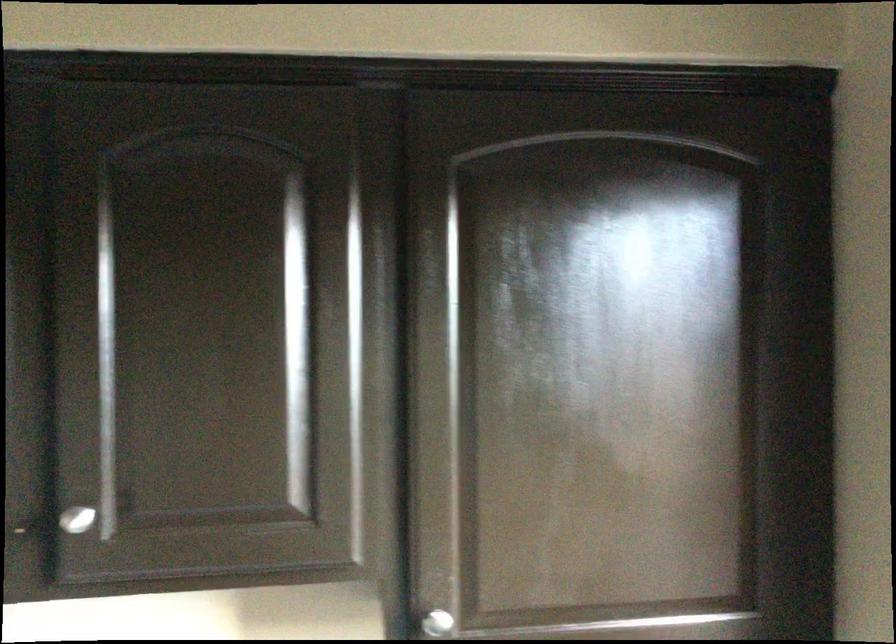
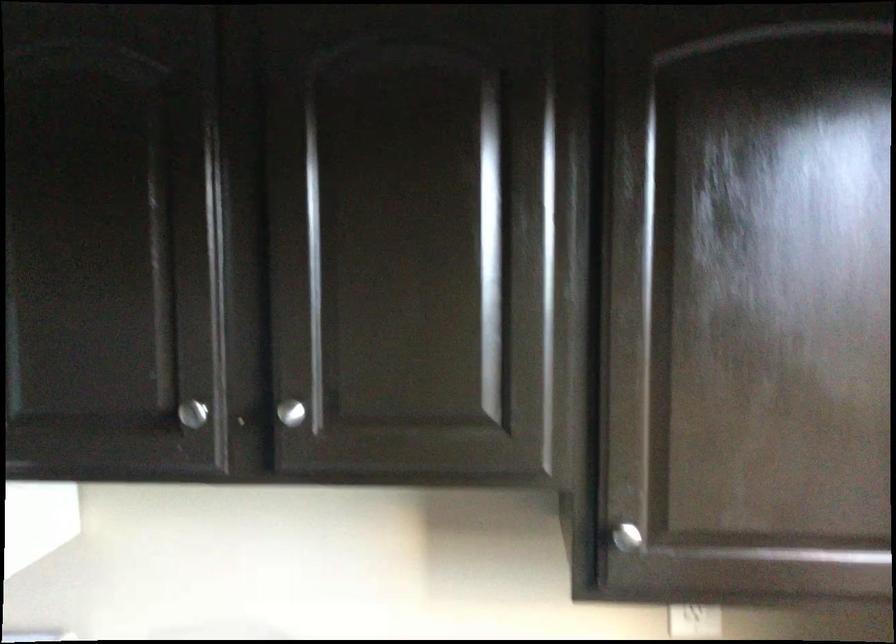
Locate, in the second image, the point that corresponds to point 74,516 in the first image.

(290, 412)